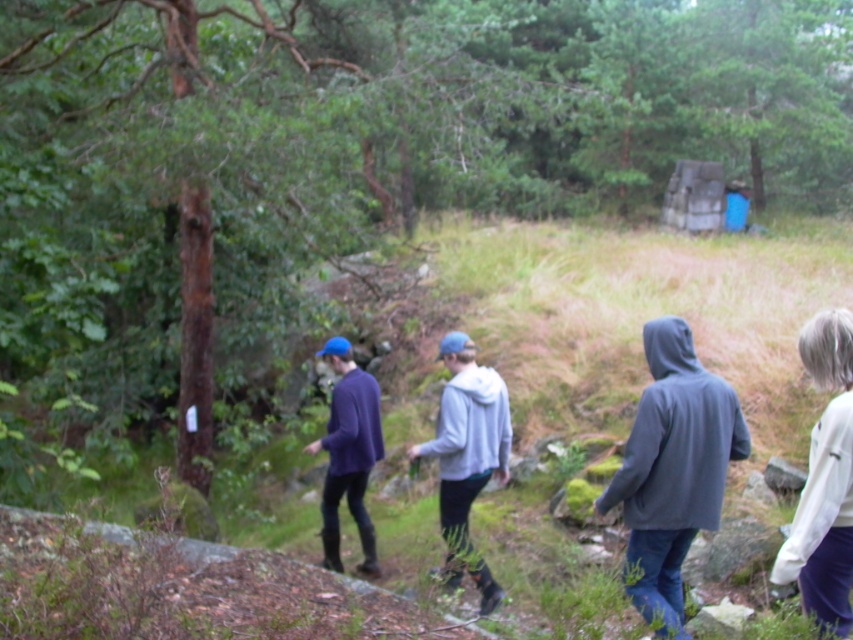
Is dark gray hoodie at center taller than white soft sweater at right?

Yes, dark gray hoodie at center is taller than white soft sweater at right.

Can you confirm if dark gray hoodie at center is positioned to the right of white soft sweater at right?

In fact, dark gray hoodie at center is to the left of white soft sweater at right.

Does point (689, 404) lie behind point (815, 484)?

Yes, point (689, 404) is farther from viewer.

Locate an element on the screen. The width and height of the screenshot is (853, 640). dark gray hoodie at center is located at coordinates (672, 467).

Based on the photo, is white soft sweater at right closer to camera compared to matte purple sweater at center?

Yes.

Who is more forward, (834,586) or (323,435)?

Positioned in front is point (834,586).

Locate an element on the screen. This screenshot has height=640, width=853. white soft sweater at right is located at coordinates (824, 483).

Which is in front, point (666, 616) or point (381, 454)?

Positioned in front is point (666, 616).

Can you confirm if dark gray hoodie at center is taller than matte purple sweater at center?

Incorrect, dark gray hoodie at center's height is not larger of matte purple sweater at center's.

Between point (616, 502) and point (363, 464), which one is positioned in front?

Point (616, 502) is more forward.

Identify the location of dark gray hoodie at center. This screenshot has height=640, width=853. (672, 467).